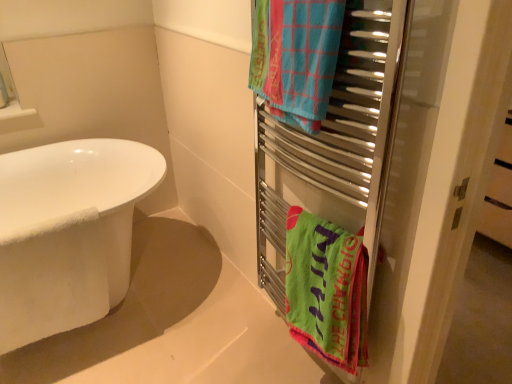
At what (x,y) coordinates should I click in order to perform the action: click on green fabric towel at right, the 2th towel/napkin in the top-to-bottom sequence. Please return your answer as a coordinate pair (x, y). Looking at the image, I should click on (326, 289).

Image resolution: width=512 pixels, height=384 pixels. In order to click on white glossy bathtub at left in this screenshot , I will do point(68,233).

At what (x,y) coordinates should I click in order to perform the action: click on white matte bathtub at lower left. Please return your answer as a coordinate pair (x, y). Image resolution: width=512 pixels, height=384 pixels. Looking at the image, I should click on click(x=173, y=324).

Identify the location of green fabric towel at right, arranged as the first towel/napkin when ordered from the bottom. (326, 289).

This screenshot has height=384, width=512. I want to click on towel/napkin that is in front of the green fabric towel at right, the 2th towel/napkin in the top-to-bottom sequence, so click(x=296, y=58).

Is blue woven towel at upper right, which appears as the 1th towel/napkin when viewed from the top, facing away from green fabric towel at right, arranged as the first towel/napkin when ordered from the bottom?

No, green fabric towel at right, arranged as the first towel/napkin when ordered from the bottom, is not at the back of blue woven towel at upper right, which appears as the 1th towel/napkin when viewed from the top.

Which of these two, blue woven towel at upper right, which appears as the 1th towel/napkin when viewed from the top, or green fabric towel at right, the 2th towel/napkin in the top-to-bottom sequence, is smaller?

With smaller size is blue woven towel at upper right, which appears as the 1th towel/napkin when viewed from the top.

Considering the points (288, 247) and (332, 71), which point is behind, point (288, 247) or point (332, 71)?

The point (288, 247) is farther.

Is green fabric towel at right, the 2th towel/napkin in the top-to-bottom sequence, with blue woven towel at upper right, which appears as the 1th towel/napkin when viewed from the top?

There is a gap between green fabric towel at right, the 2th towel/napkin in the top-to-bottom sequence, and blue woven towel at upper right, which appears as the 1th towel/napkin when viewed from the top.

Which object is wider, green fabric towel at right, the 2th towel/napkin in the top-to-bottom sequence, or blue woven towel at upper right, which appears as the 1th towel/napkin when viewed from the top?

Wider between the two is blue woven towel at upper right, which appears as the 1th towel/napkin when viewed from the top.

How many degrees apart are the facing directions of green fabric towel at right, arranged as the first towel/napkin when ordered from the bottom, and blue woven towel at upper right, the 2th towel/napkin positioned from the bottom?

green fabric towel at right, arranged as the first towel/napkin when ordered from the bottom, and blue woven towel at upper right, the 2th towel/napkin positioned from the bottom, are facing 0.00043 degrees away from each other.

Would you consider blue woven towel at upper right, the 2th towel/napkin positioned from the bottom, to be distant from white glossy bathtub at left?

Absolutely, blue woven towel at upper right, the 2th towel/napkin positioned from the bottom, is distant from white glossy bathtub at left.

Which is closer to the camera, (x=259, y=27) or (x=72, y=252)?

The point (x=259, y=27) is more forward.

Could you measure the distance between blue woven towel at upper right, the 2th towel/napkin positioned from the bottom, and white glossy bathtub at left?

blue woven towel at upper right, the 2th towel/napkin positioned from the bottom, and white glossy bathtub at left are 1.01 meters apart.

Is blue woven towel at upper right, the 2th towel/napkin positioned from the bottom, facing towards white glossy bathtub at left?

No.

Which of these two, white glossy bathtub at left or blue woven towel at upper right, which appears as the 1th towel/napkin when viewed from the top, is wider?

white glossy bathtub at left.

Can we say white glossy bathtub at left lies outside blue woven towel at upper right, which appears as the 1th towel/napkin when viewed from the top?

Yes, white glossy bathtub at left is not within blue woven towel at upper right, which appears as the 1th towel/napkin when viewed from the top.

Based on the photo, can you confirm if white glossy bathtub at left is shorter than blue woven towel at upper right, which appears as the 1th towel/napkin when viewed from the top?

In fact, white glossy bathtub at left may be taller than blue woven towel at upper right, which appears as the 1th towel/napkin when viewed from the top.

Considering the relative sizes of white glossy bathtub at left and blue woven towel at upper right, the 2th towel/napkin positioned from the bottom, in the image provided, is white glossy bathtub at left bigger than blue woven towel at upper right, the 2th towel/napkin positioned from the bottom,?

Yes.

Based on the photo, in the image, is metal towel rack at right positioned in front of or behind blue woven towel at upper right, the 2th towel/napkin positioned from the bottom?

Clearly, metal towel rack at right is in front of blue woven towel at upper right, the 2th towel/napkin positioned from the bottom.

Measure the distance between metal towel rack at right and blue woven towel at upper right, the 2th towel/napkin positioned from the bottom.

The distance of metal towel rack at right from blue woven towel at upper right, the 2th towel/napkin positioned from the bottom, is 21.49 centimeters.

Is point (350, 136) farther from camera compared to point (309, 109)?

Yes, it is behind point (309, 109).

Which of these two, metal towel rack at right or blue woven towel at upper right, the 2th towel/napkin positioned from the bottom, is bigger?

Bigger between the two is metal towel rack at right.

Considering the relative sizes of green fabric towel at right, the 2th towel/napkin in the top-to-bottom sequence, and white glossy bathtub at left in the image provided, is green fabric towel at right, the 2th towel/napkin in the top-to-bottom sequence, thinner than white glossy bathtub at left?

Correct, the width of green fabric towel at right, the 2th towel/napkin in the top-to-bottom sequence, is less than that of white glossy bathtub at left.

Is green fabric towel at right, arranged as the first towel/napkin when ordered from the bottom, taller or shorter than white glossy bathtub at left?

In the image, green fabric towel at right, arranged as the first towel/napkin when ordered from the bottom, appears to be shorter than white glossy bathtub at left.

Is green fabric towel at right, the 2th towel/napkin in the top-to-bottom sequence, far away from white glossy bathtub at left?

No, green fabric towel at right, the 2th towel/napkin in the top-to-bottom sequence, is not far from white glossy bathtub at left.

Identify the location of bathtub above the green fabric towel at right, the 2th towel/napkin in the top-to-bottom sequence (from the image's perspective). Image resolution: width=512 pixels, height=384 pixels. (68, 233).

Between white glossy bathtub at left and metal towel rack at right, which one has larger width?

white glossy bathtub at left.

Is white glossy bathtub at left placed right next to metal towel rack at right?

white glossy bathtub at left and metal towel rack at right are clearly separated.

Would you say white glossy bathtub at left is outside metal towel rack at right?

Yes.

From a real-world perspective, who is located higher, white glossy bathtub at left or metal towel rack at right?

metal towel rack at right.

Where is `towel/napkin in front of the green fabric towel at right, the 2th towel/napkin in the top-to-bottom sequence`? Image resolution: width=512 pixels, height=384 pixels. towel/napkin in front of the green fabric towel at right, the 2th towel/napkin in the top-to-bottom sequence is located at coordinates (296, 58).

Where is `towel/napkin that is below the blue woven towel at upper right, which appears as the 1th towel/napkin when viewed from the top (from the image's perspective)`? The image size is (512, 384). towel/napkin that is below the blue woven towel at upper right, which appears as the 1th towel/napkin when viewed from the top (from the image's perspective) is located at coordinates (326, 289).

Looking at the image, which one is located further to blue woven towel at upper right, the 2th towel/napkin positioned from the bottom, green fabric towel at right, the 2th towel/napkin in the top-to-bottom sequence, or white glossy bathtub at left?

white glossy bathtub at left is positioned further to the anchor blue woven towel at upper right, the 2th towel/napkin positioned from the bottom.

Based on their spatial positions, is white matte bathtub at lower left or white glossy bathtub at left closer to blue woven towel at upper right, which appears as the 1th towel/napkin when viewed from the top?

The object closer to blue woven towel at upper right, which appears as the 1th towel/napkin when viewed from the top, is white glossy bathtub at left.

When comparing their distances from white matte bathtub at lower left, does green fabric towel at right, the 2th towel/napkin in the top-to-bottom sequence, or blue woven towel at upper right, the 2th towel/napkin positioned from the bottom, seem further?

blue woven towel at upper right, the 2th towel/napkin positioned from the bottom, is positioned further to the anchor white matte bathtub at lower left.

Estimate the real-world distances between objects in this image. Which object is closer to metal towel rack at right, green fabric towel at right, the 2th towel/napkin in the top-to-bottom sequence, or white glossy bathtub at left?

Among the two, green fabric towel at right, the 2th towel/napkin in the top-to-bottom sequence, is located nearer to metal towel rack at right.

Which object lies further to the anchor point white glossy bathtub at left, blue woven towel at upper right, the 2th towel/napkin positioned from the bottom, or green fabric towel at right, the 2th towel/napkin in the top-to-bottom sequence?

blue woven towel at upper right, the 2th towel/napkin positioned from the bottom.

From the image, which object appears to be farther from green fabric towel at right, the 2th towel/napkin in the top-to-bottom sequence, white matte bathtub at lower left or metal towel rack at right?

white matte bathtub at lower left is positioned further to the anchor green fabric towel at right, the 2th towel/napkin in the top-to-bottom sequence.

Looking at the image, which one is located closer to blue woven towel at upper right, the 2th towel/napkin positioned from the bottom, white glossy bathtub at left or green fabric towel at right, the 2th towel/napkin in the top-to-bottom sequence?

green fabric towel at right, the 2th towel/napkin in the top-to-bottom sequence, is positioned closer to the anchor blue woven towel at upper right, the 2th towel/napkin positioned from the bottom.

Based on their spatial positions, is blue woven towel at upper right, the 2th towel/napkin positioned from the bottom, or white glossy bathtub at left closer to green fabric towel at right, the 2th towel/napkin in the top-to-bottom sequence?

Among the two, blue woven towel at upper right, the 2th towel/napkin positioned from the bottom, is located nearer to green fabric towel at right, the 2th towel/napkin in the top-to-bottom sequence.

At what (x,y) coordinates should I click in order to perform the action: click on bath situated between white glossy bathtub at left and metal towel rack at right from left to right. Please return your answer as a coordinate pair (x, y). Looking at the image, I should click on (173, 324).

Where is `bath located between white glossy bathtub at left and blue woven towel at upper right, which appears as the 1th towel/napkin when viewed from the top, in the left-right direction`? This screenshot has height=384, width=512. bath located between white glossy bathtub at left and blue woven towel at upper right, which appears as the 1th towel/napkin when viewed from the top, in the left-right direction is located at coordinates (173, 324).

Find the location of a particular element. The image size is (512, 384). towel/napkin between white glossy bathtub at left and green fabric towel at right, the 2th towel/napkin in the top-to-bottom sequence, from left to right is located at coordinates (296, 58).

Where is `bath between white glossy bathtub at left and green fabric towel at right, arranged as the first towel/napkin when ordered from the bottom, in the horizontal direction`? This screenshot has width=512, height=384. bath between white glossy bathtub at left and green fabric towel at right, arranged as the first towel/napkin when ordered from the bottom, in the horizontal direction is located at coordinates (173, 324).